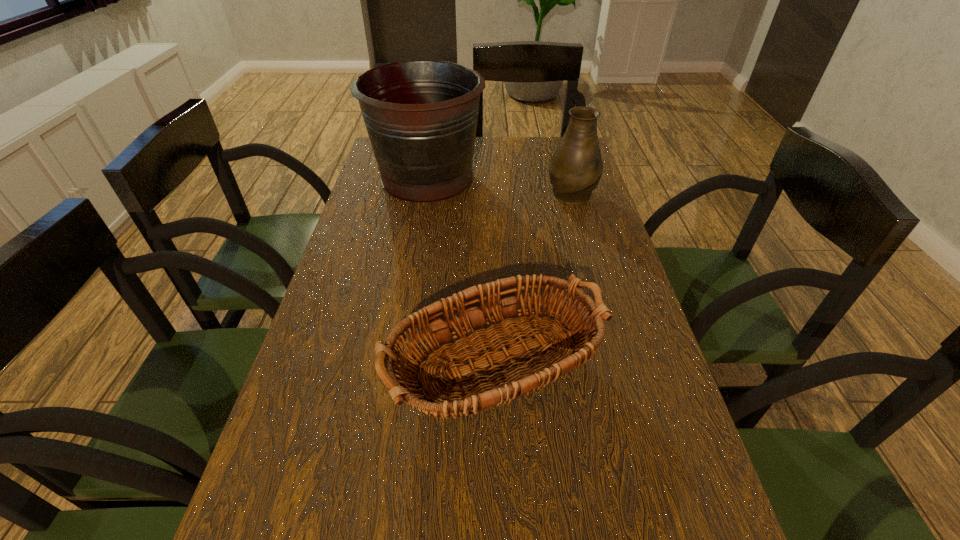
The width and height of the screenshot is (960, 540). I want to click on object that is at the left edge, so [421, 116].

Where is `pitcher located in the right edge section of the desktop`? pitcher located in the right edge section of the desktop is located at coordinates (575, 169).

Locate an element on the screen. basket present at the right edge is located at coordinates (521, 376).

Identify the location of object that is at the far left corner. Image resolution: width=960 pixels, height=540 pixels. (421, 116).

Locate an element on the screen. blank space at the far edge is located at coordinates [516, 148].

Identify the location of blank space at the left edge of the desktop. The width and height of the screenshot is (960, 540). [x=275, y=504].

At what (x,y) coordinates should I click in order to perform the action: click on vacant area at the right edge of the desktop. Please return your answer as a coordinate pair (x, y). Looking at the image, I should click on (668, 402).

This screenshot has height=540, width=960. In order to click on vacant area between the tallest object and the pitcher in this screenshot , I will do `click(499, 185)`.

The height and width of the screenshot is (540, 960). I want to click on vacant area that lies between the second shortest object and the bucket, so click(499, 185).

The width and height of the screenshot is (960, 540). Find the location of `object that is the second nearest to the second shortest object`. object that is the second nearest to the second shortest object is located at coordinates (521, 376).